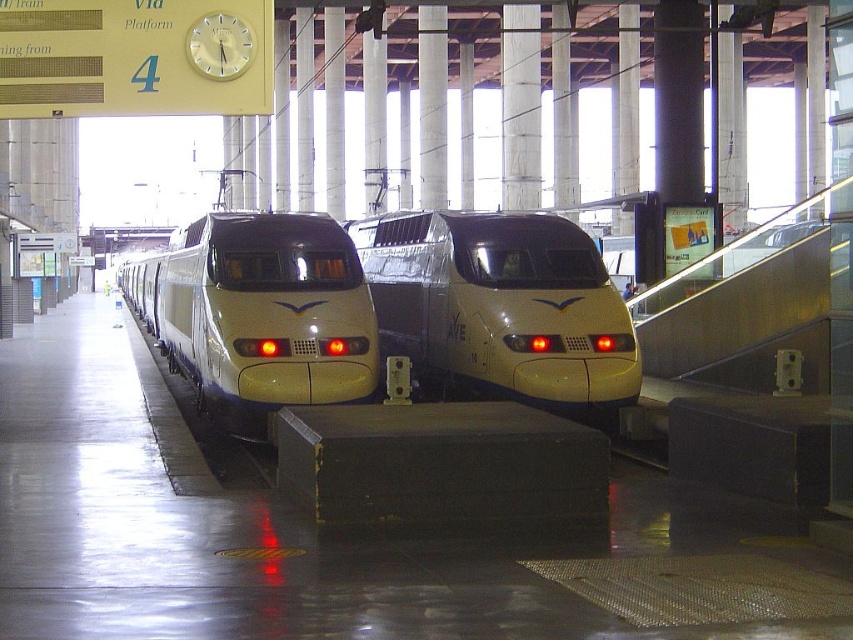
You are a passenger waiting on the platform and see the white glossy passenger train at center and the white glossy train at center. Which one is closer to you?

The white glossy passenger train at center is closer to you because it is positioned over the white glossy train at center, indicating it is in front.

You are a station attendant and need to determine which train to direct passengers to for boarding. Both the white glossy passenger train at center and the white glossy train at center are present. Which one is smaller and more suitable for a smaller group of passengers?

The white glossy passenger train at center is smaller than the white glossy train at center, making it more suitable for a smaller group of passengers.